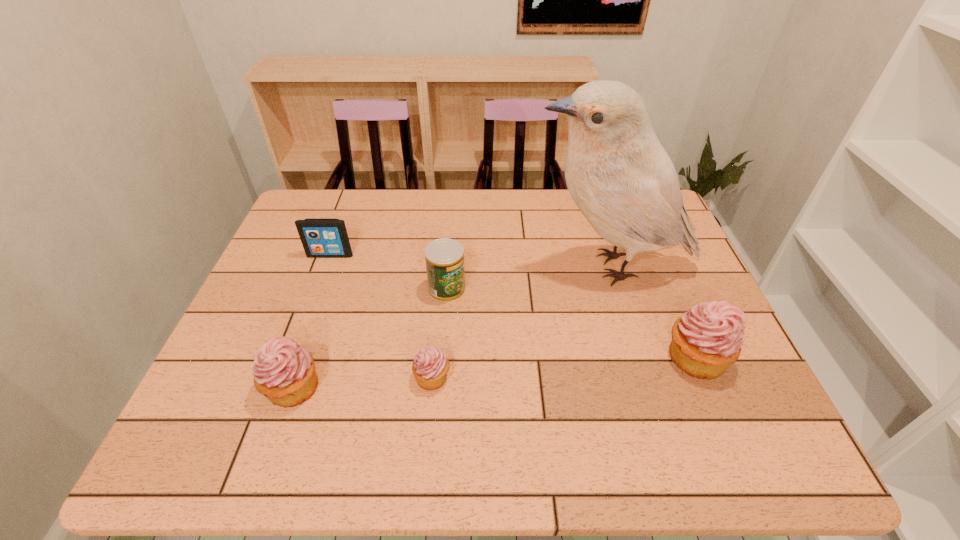
Locate an element on the screen. This screenshot has height=540, width=960. object located at the near right corner is located at coordinates (708, 338).

Locate an element on the screen. vacant space at the far edge is located at coordinates (504, 206).

Locate an element on the screen. The height and width of the screenshot is (540, 960). vacant space at the near edge is located at coordinates (571, 403).

At what (x,y) coordinates should I click in order to perform the action: click on vacant area at the left edge. Please return your answer as a coordinate pair (x, y). The width and height of the screenshot is (960, 540). Looking at the image, I should click on (263, 318).

Where is `vacant region at the right edge of the desktop`? The image size is (960, 540). vacant region at the right edge of the desktop is located at coordinates (666, 350).

Image resolution: width=960 pixels, height=540 pixels. I want to click on vacant space at the far left corner of the desktop, so click(340, 210).

Where is `vacant space at the near left corner of the desktop`? This screenshot has height=540, width=960. vacant space at the near left corner of the desktop is located at coordinates (217, 384).

Find the location of `free area in between the can and the rightmost cupcake`. free area in between the can and the rightmost cupcake is located at coordinates (571, 323).

Where is `vacant area between the tallest object and the rightmost cupcake`? The image size is (960, 540). vacant area between the tallest object and the rightmost cupcake is located at coordinates (653, 312).

What are the coordinates of `free space between the rightmost cupcake and the shortest cupcake` in the screenshot? It's located at 564,367.